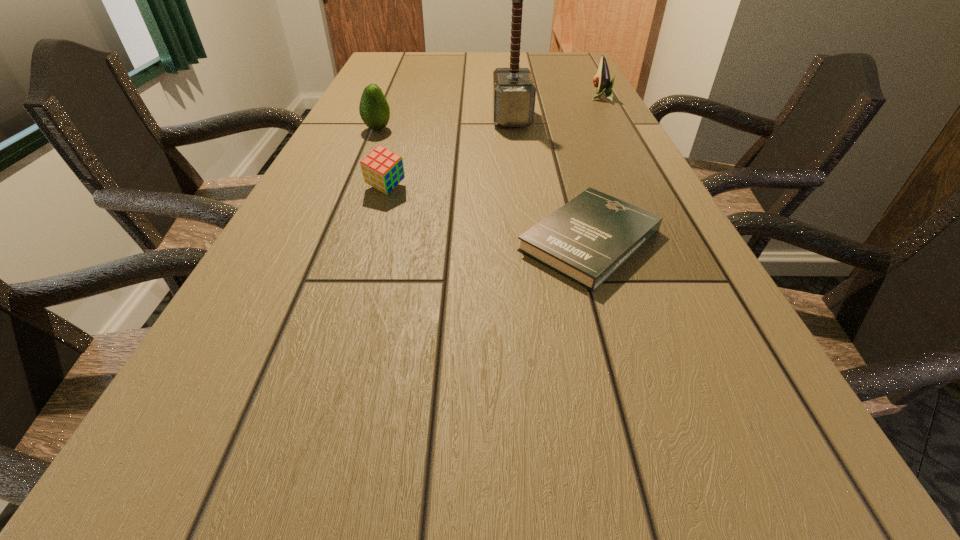
This screenshot has height=540, width=960. Identify the location of hammer. (514, 91).

Locate an element on the screen. Image resolution: width=960 pixels, height=540 pixels. the farther avocado is located at coordinates (602, 82).

Locate an element on the screen. The width and height of the screenshot is (960, 540). the right avocado is located at coordinates (602, 82).

Find the location of `the left avocado`. the left avocado is located at coordinates (374, 110).

Locate an element on the screen. The height and width of the screenshot is (540, 960). the fourth tallest object is located at coordinates (382, 169).

Where is `book`? This screenshot has height=540, width=960. book is located at coordinates (586, 240).

Locate an element on the screen. vacant region located 0.280m on the back of the tallest object is located at coordinates (506, 75).

This screenshot has width=960, height=540. In order to click on vacant space situated 0.080m on the seed side of the right avocado in this screenshot , I will do `click(564, 98)`.

Identify the location of free space located 0.140m on the seed side of the right avocado. The image size is (960, 540). (543, 98).

Image resolution: width=960 pixels, height=540 pixels. I want to click on vacant point located 0.310m on the seed side of the right avocado, so click(x=487, y=98).